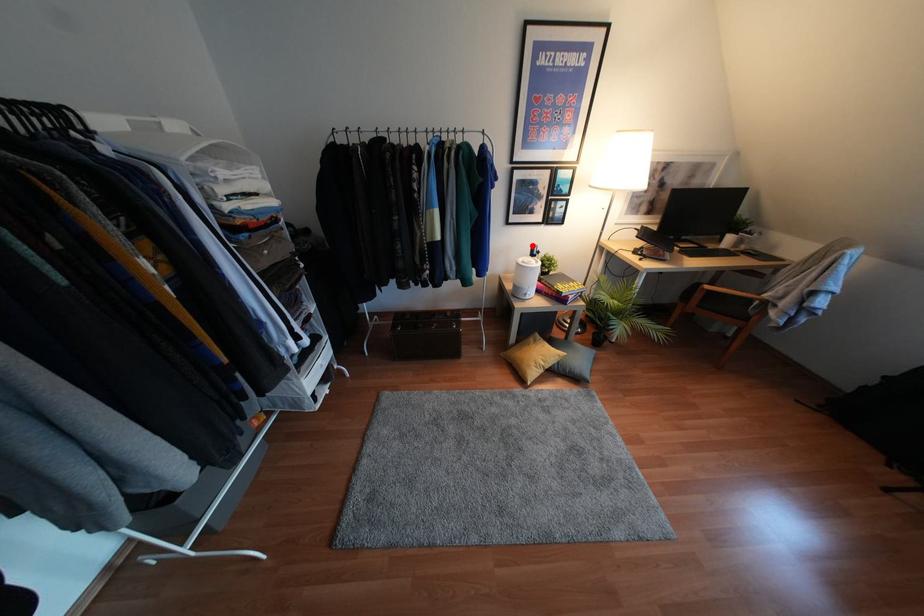
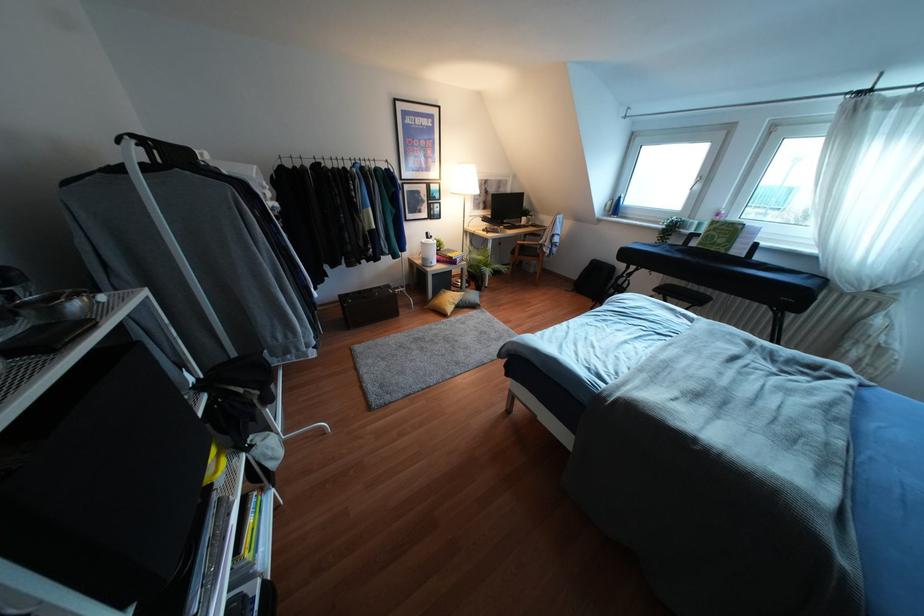
Where in the second image is the point corresponding to the highlighted location from the first image?

(427, 233)